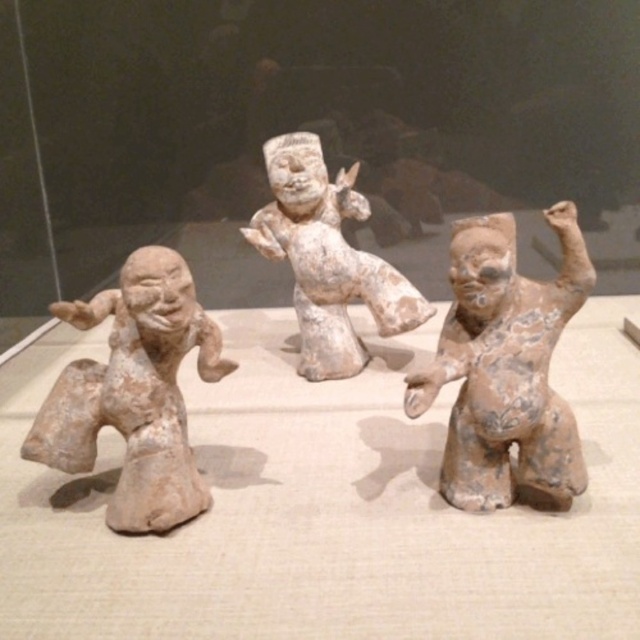
Question: Can you confirm if earthy clay figure at center is thinner than matte clay figure at left?

Choices:
 (A) no
 (B) yes

Answer: (B)

Question: Estimate the real-world distances between objects in this image. Which object is farther from the earthy clay figure at center?

Choices:
 (A) white clay figure at center
 (B) matte clay figure at left

Answer: (A)

Question: Among these points, which one is farthest from the camera?

Choices:
 (A) (516, 401)
 (B) (352, 182)

Answer: (B)

Question: Which of these objects is positioned farthest from the matte clay figure at left?

Choices:
 (A) white clay figure at center
 (B) earthy clay figure at center

Answer: (A)

Question: Can you confirm if earthy clay figure at center is positioned above matte clay figure at left?

Choices:
 (A) yes
 (B) no

Answer: (A)

Question: Can you confirm if earthy clay figure at center is thinner than matte clay figure at left?

Choices:
 (A) yes
 (B) no

Answer: (A)